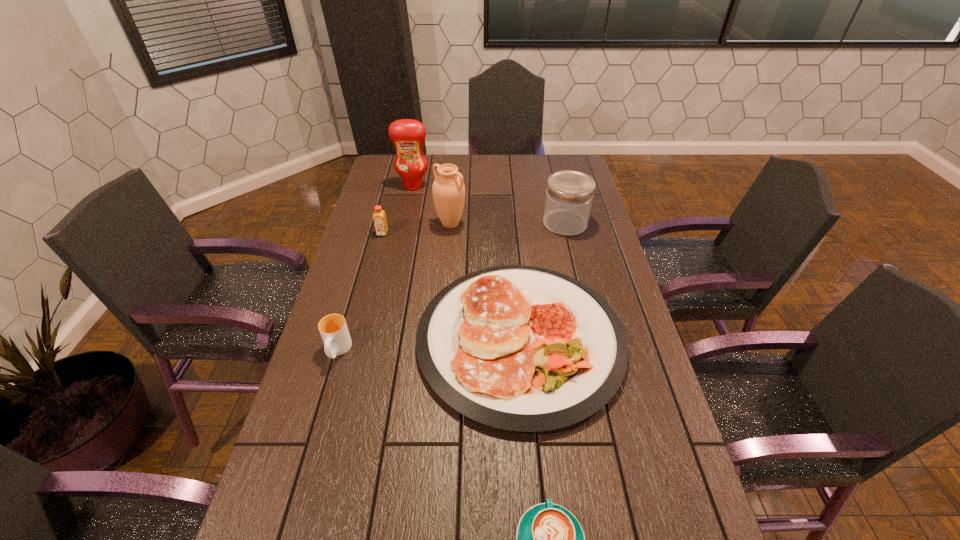
At what (x,y) coordinates should I click in order to perform the action: click on vacant space that satisfies the following two spatial constraints: 1. on the label side of the tallest object; 2. on the right side of the dish. Please return your answer as a coordinate pair (x, y). This screenshot has height=540, width=960. Looking at the image, I should click on (381, 340).

Locate an element on the screen. blank area in the image that satisfies the following two spatial constraints: 1. on the front and back of the orange juice; 2. on the right side of the dish is located at coordinates (354, 340).